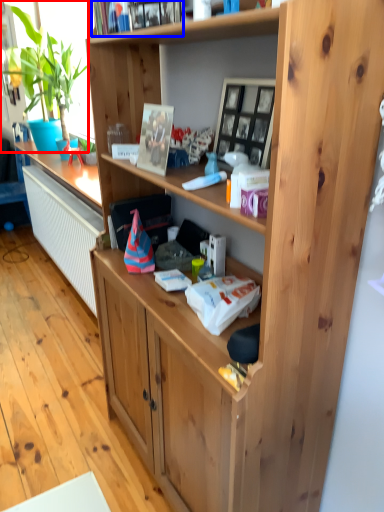
Question: Among these objects, which one is farthest to the camera, houseplant (highlighted by a red box) or book (highlighted by a blue box)?

Choices:
 (A) houseplant
 (B) book

Answer: (A)